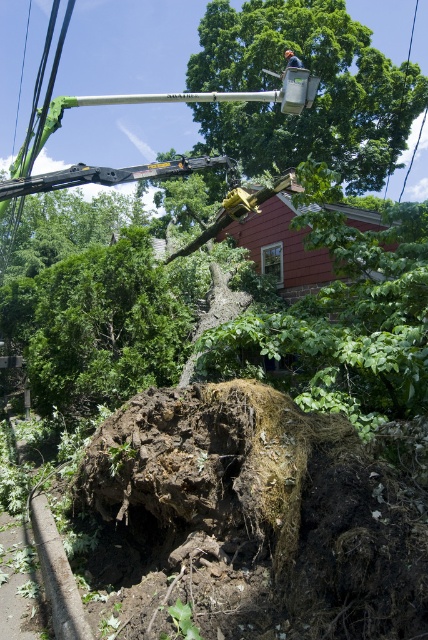
You are a landscape architect planning to install a new walkway between the green leafy tree at upper center and the green leafy tree at lower left. The walkway requires a minimum clearance of 50 feet between the two trees to accommodate its design. Based on the scene, will the existing spacing between these two trees allow for this requirement?

The distance between the green leafy tree at upper center and the green leafy tree at lower left is 56.44 feet, which exceeds the required 50 feet clearance. Therefore, the existing spacing allows for the installation of the walkway with the needed clearance.

You are a landscape architect planning to plant a new tree in the residential area. You notice the green leafy tree at upper center. Where exactly is this tree positioned in the scene?

The green leafy tree at upper center is located at point (317,93).

You are a landscape architect planning to plant new trees in the area. Given the size difference between the green leafy tree at upper center and the green leafy tree at lower left, which tree would require more space for its root system?

The green leafy tree at upper center requires more space for its root system because it is bigger than the green leafy tree at lower left.